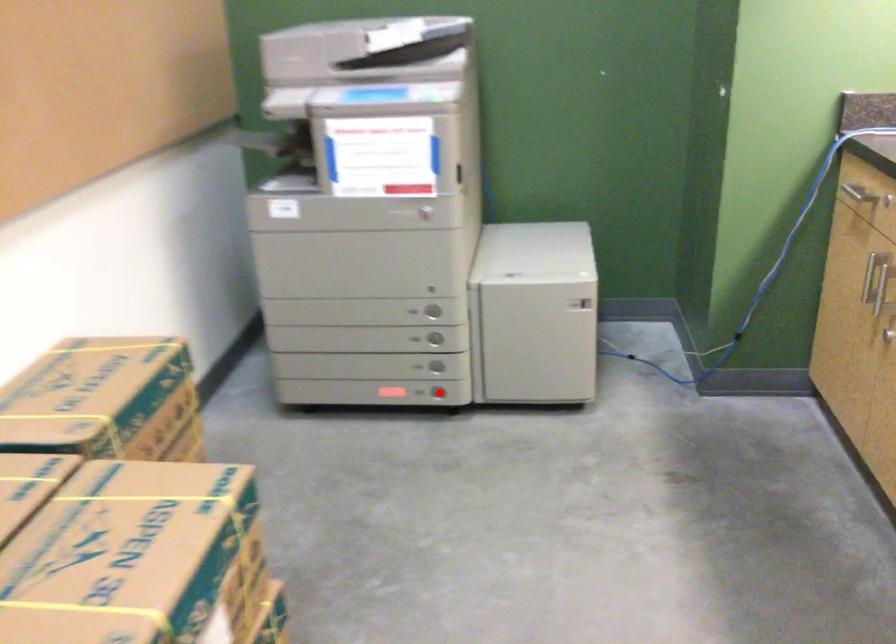
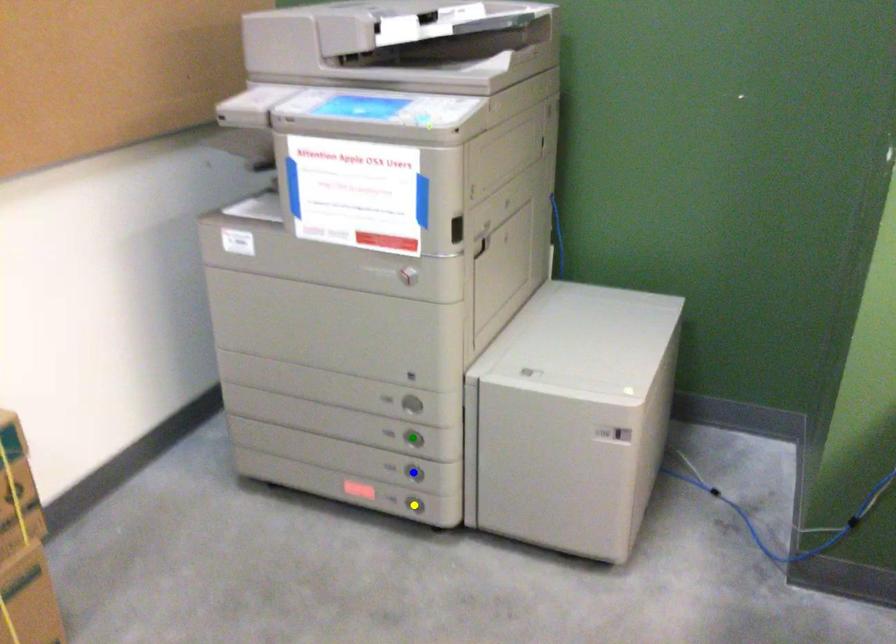
Question: I am providing you with two images of the same scene from different viewpoints. A red point is marked on the first image. You are given multiple points on the second image. Which point in image 2 represents the same 3d spot as the red point in image 1?

Choices:
 (A) yellow point
 (B) green point
 (C) blue point

Answer: (A)